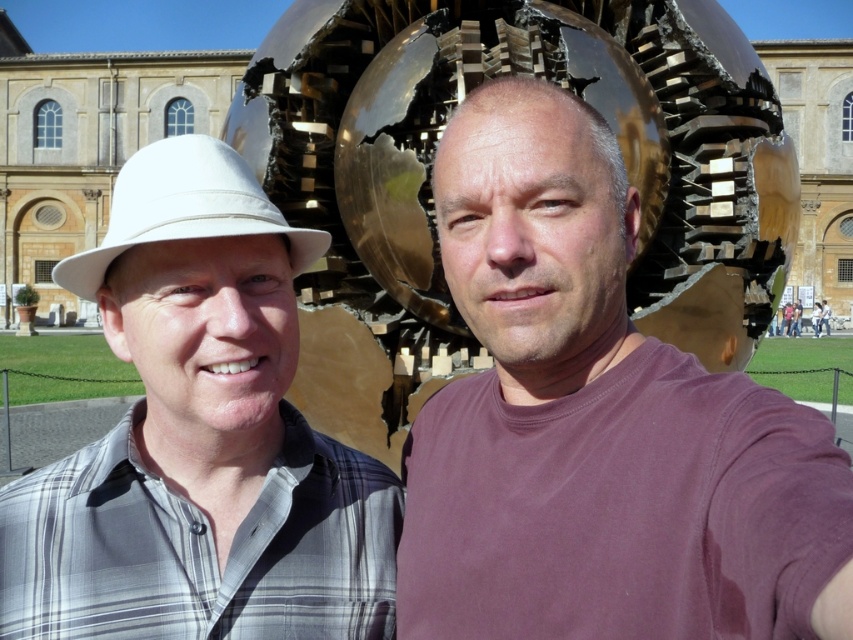
Who is taller, white fabric baseball hat at left or matte white hat at upper left?

Standing taller between the two is white fabric baseball hat at left.

Does white fabric baseball hat at left appear over matte white hat at upper left?

Indeed, white fabric baseball hat at left is positioned over matte white hat at upper left.

Which is in front, point (193, 150) or point (787, 308)?

Point (193, 150) is in front.

The width and height of the screenshot is (853, 640). What are the coordinates of `white fabric baseball hat at left` in the screenshot? It's located at (184, 209).

Can you confirm if white matte hat at left is positioned to the right of matte white hat at upper left?

In fact, white matte hat at left is to the left of matte white hat at upper left.

Describe the element at coordinates (200, 438) in the screenshot. This screenshot has height=640, width=853. I see `white matte hat at left` at that location.

Between point (90, 253) and point (793, 324), which one is positioned behind?

The point (793, 324) is more distant.

Locate an element on the screen. Image resolution: width=853 pixels, height=640 pixels. white matte hat at left is located at coordinates (200, 438).

Can you confirm if gold reflective globe at center is bigger than white fabric baseball hat at left?

Indeed, gold reflective globe at center has a larger size compared to white fabric baseball hat at left.

Can you confirm if gold reflective globe at center is taller than white fabric baseball hat at left?

Indeed, gold reflective globe at center has a greater height compared to white fabric baseball hat at left.

Between point (668, 90) and point (206, 221), which one is positioned behind?

Point (668, 90)

This screenshot has height=640, width=853. I want to click on gold reflective globe at center, so click(492, 76).